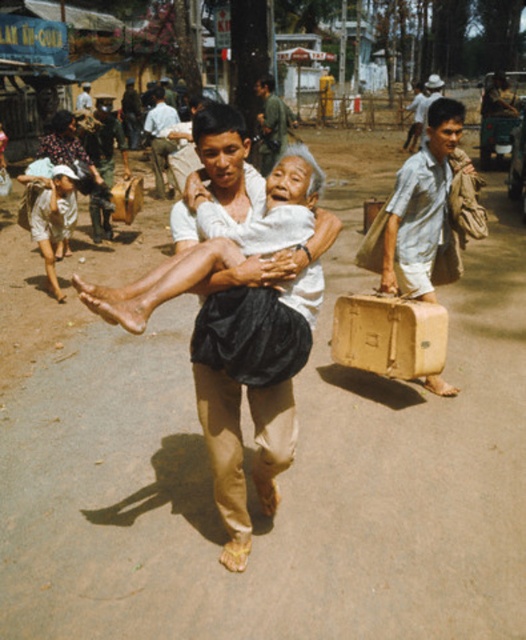
You are a photographer analyzing the composition of this image. You notice the matte black cloth at center and the light blue shirt at center. Which object appears narrower in the image?

The matte black cloth at center has a lesser width compared to the light blue shirt at center, so it appears narrower.

You are a photographer observing this scene. You notice the khaki pants at center and the light brown fabric shirt at lower left. Which object is closer to you?

The khaki pants at center is closer to you because it is in front of the light brown fabric shirt at lower left.

Based on the scene, which object from the list is taller? Please choose between the khaki pants at center and the light brown fabric shirt at lower left.

The khaki pants at center is much taller than the light brown fabric shirt at lower left.